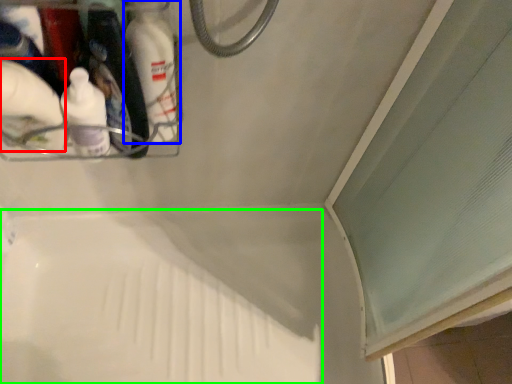
Question: Which object is the closest to the cleaning product (highlighted by a red box)? Choose among these: bottle (highlighted by a blue box) or bath (highlighted by a green box).

Choices:
 (A) bottle
 (B) bath

Answer: (A)